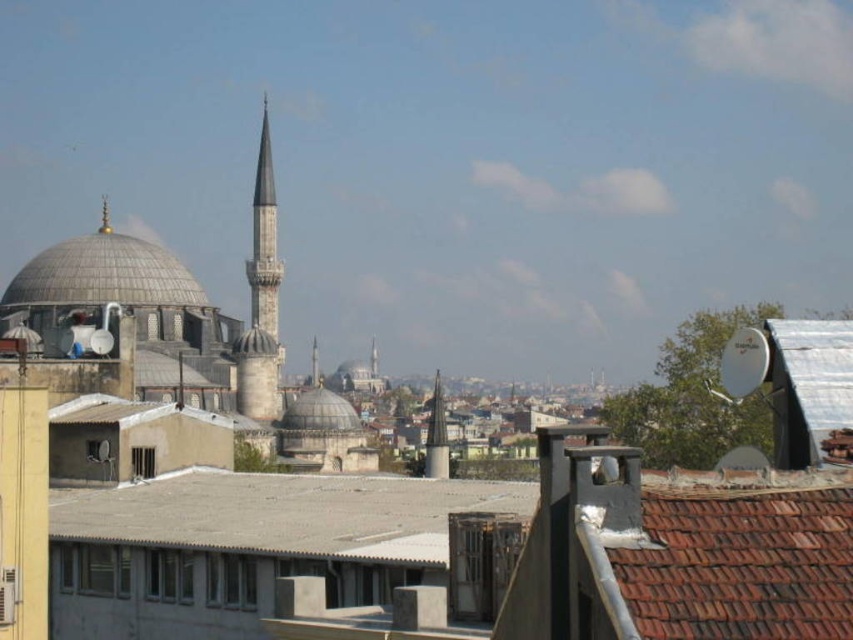
You are an architect analyzing this cityscape. You notice the brown tile roof at lower right and the smooth silver spire at center. Which structure is shorter in height?

The brown tile roof at lower right is not as tall as the smooth silver spire at center, so the brown tile roof at lower right is shorter in height.

You are a drone operator tasked with capturing aerial footage of the city. Your drone is currently at the center of the image. To reach the brown tile roof at lower right, in which direction should you steer the drone?

You should steer the drone towards the lower right direction to reach the brown tile roof at lower right since it is located at point (740, 564).